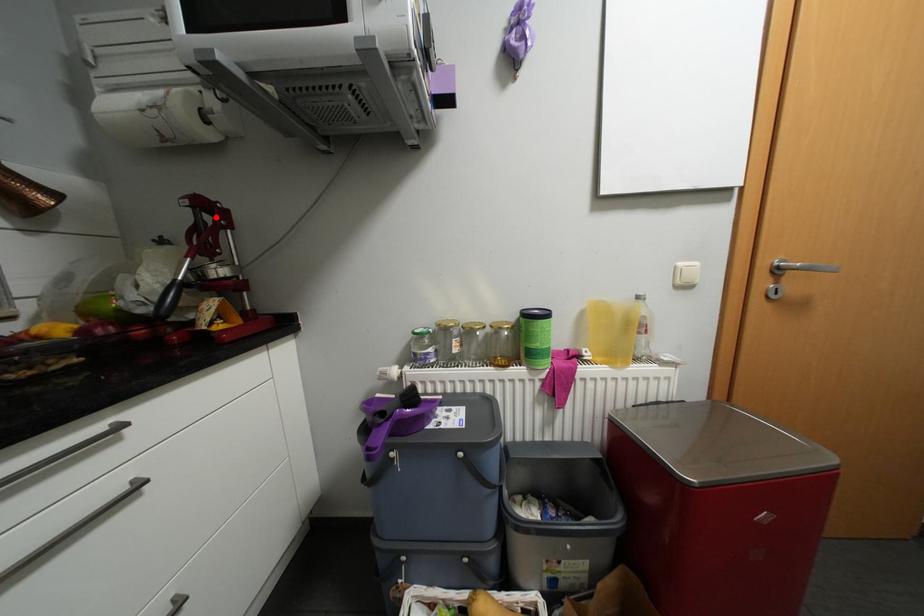
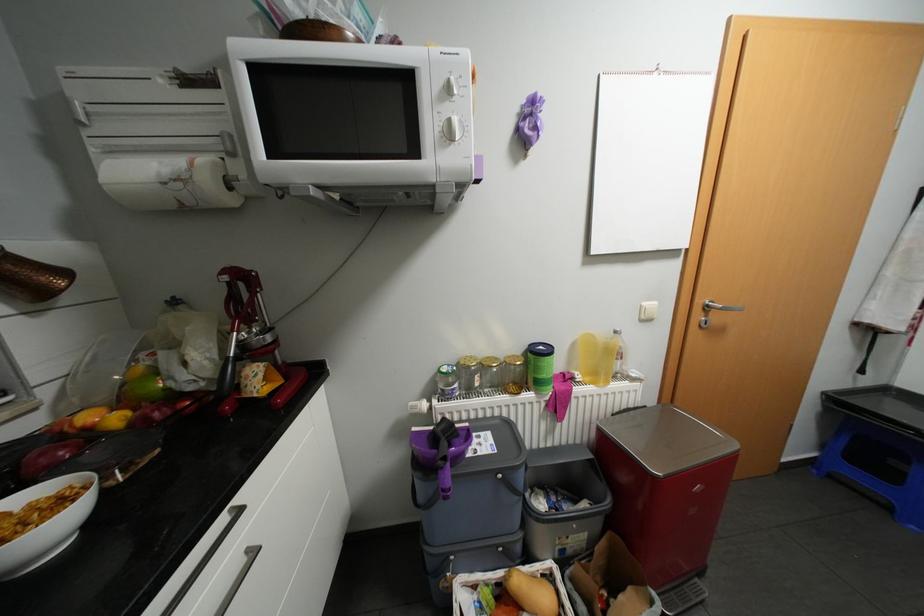
In the second image, find the point that corresponds to the highlighted location in the first image.

(248, 284)